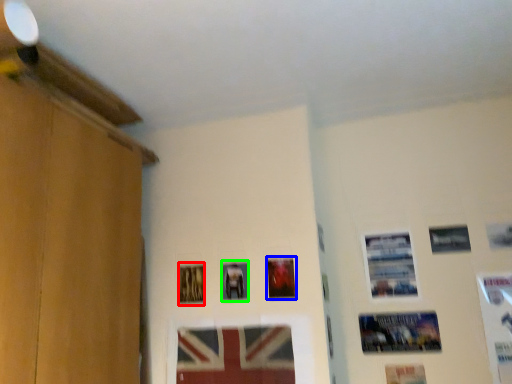
Question: Considering the real-world distances, which object is farthest from picture frame (highlighted by a red box)? picture frame (highlighted by a blue box) or picture frame (highlighted by a green box)?

Choices:
 (A) picture frame
 (B) picture frame

Answer: (A)